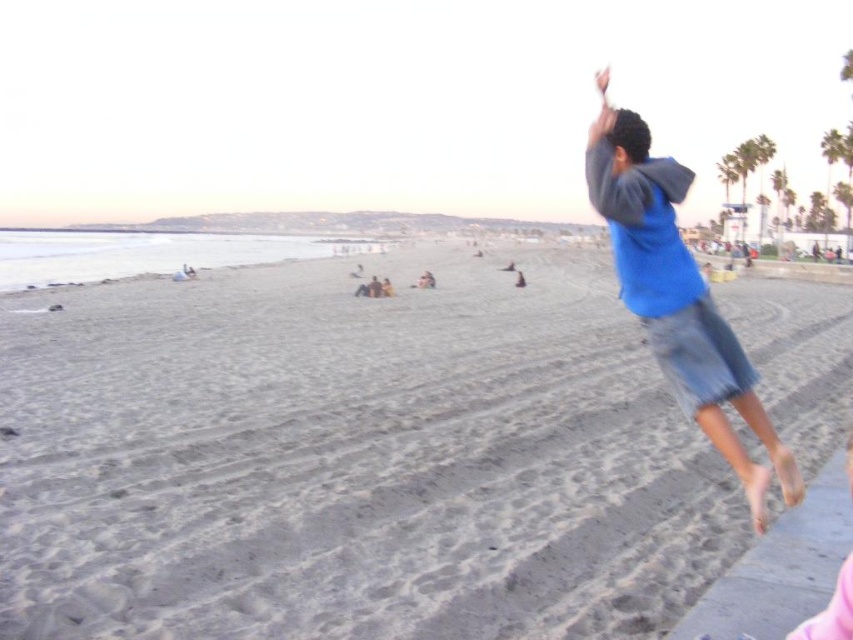
Is point (675, 602) positioned behind point (647, 186)?

Yes, point (675, 602) is farther from viewer.

How distant is gray sand at lower center from blue cotton shirt at upper right?

gray sand at lower center and blue cotton shirt at upper right are 7.92 meters apart.

Who is more forward, (x=289, y=454) or (x=659, y=339)?

Point (x=659, y=339) is more forward.

In order to click on gray sand at lower center in this screenshot , I will do `click(350, 460)`.